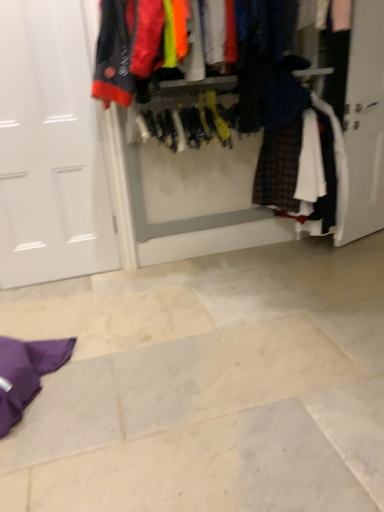
Question: Is textured fabric closet at center to the left or to the right of white matte door at left in the image?

Choices:
 (A) right
 (B) left

Answer: (A)

Question: Is textured fabric closet at center bigger or smaller than white matte door at left?

Choices:
 (A) big
 (B) small

Answer: (A)

Question: Considering their positions, is textured fabric closet at center located in front of or behind white matte door at left?

Choices:
 (A) behind
 (B) front

Answer: (B)

Question: From the image's perspective, relative to textured fabric closet at center, is white matte door at left above or below?

Choices:
 (A) below
 (B) above

Answer: (A)

Question: Is white matte door at left wider or thinner than textured fabric closet at center?

Choices:
 (A) wide
 (B) thin

Answer: (B)

Question: In terms of size, does white matte door at left appear bigger or smaller than textured fabric closet at center?

Choices:
 (A) small
 (B) big

Answer: (A)

Question: In the image, is white matte door at left positioned in front of or behind textured fabric closet at center?

Choices:
 (A) front
 (B) behind

Answer: (B)